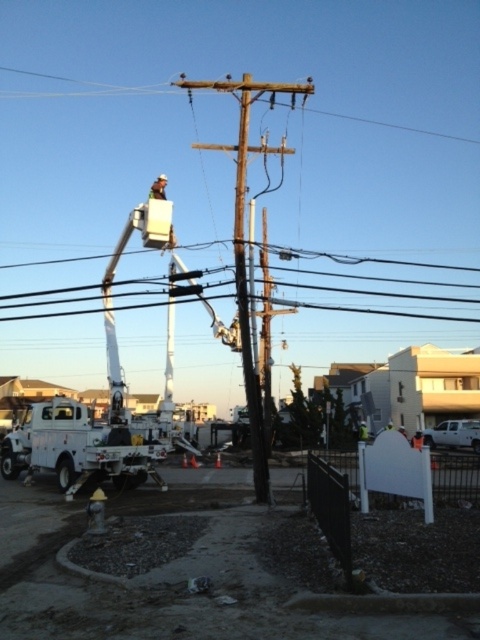
You are a pedestrian standing on the sidewalk and see the white plastic fire hydrant at lower left and the black wire at upper center. Which object is nearer to you?

The white plastic fire hydrant at lower left is closer to the viewer than the black wire at upper center.

You are a construction worker who needs to place a 1.2 meter long safety barrier between the white plastic fire hydrant at lower left and the light brown leather helmet at upper center. Given their height difference, will the barrier fit vertically between them?

The white plastic fire hydrant at lower left is not as tall as the light brown leather helmet at upper center. Since the safety barrier is 1.2 meters long, it can be placed vertically between them as the height difference allows sufficient space.